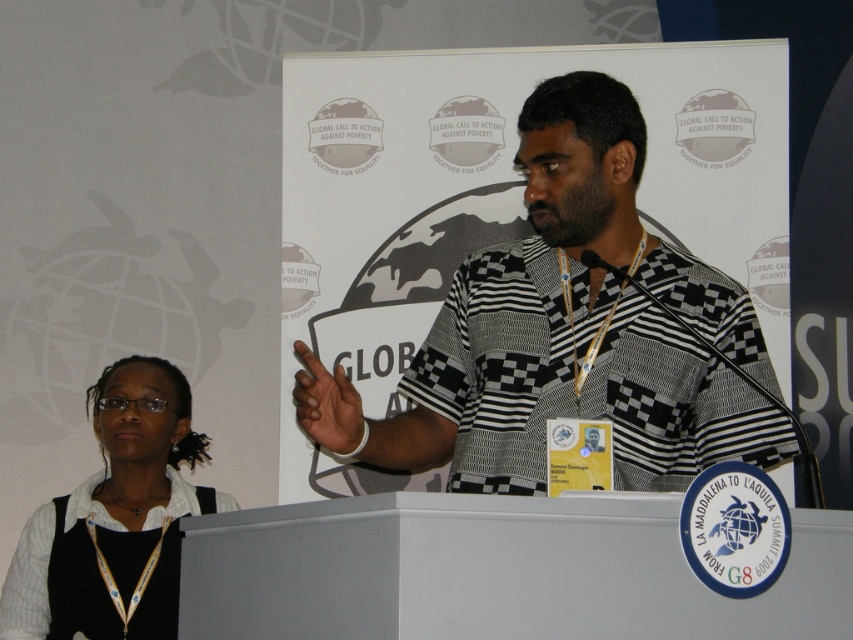
Based on the scene description, which object is wider between the black and white checkered shirt at center and the white glossy shirt at lower left?

The black and white checkered shirt at center is wider than the white glossy shirt at lower left according to the description.